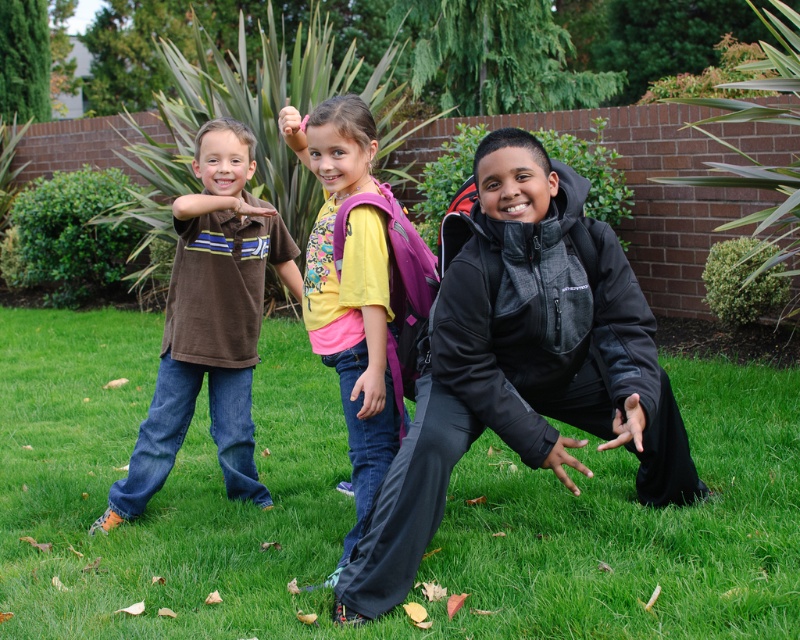
Which is more to the right, black softshell jacket at center or yellow cotton shirt at center?

black softshell jacket at center

What do you see at coordinates (521, 362) in the screenshot? Image resolution: width=800 pixels, height=640 pixels. I see `black softshell jacket at center` at bounding box center [521, 362].

Where is `black softshell jacket at center`? This screenshot has width=800, height=640. black softshell jacket at center is located at coordinates (521, 362).

Is green grass at center smaller than black softshell jacket at center?

Yes, green grass at center is smaller than black softshell jacket at center.

Does green grass at center have a lesser width compared to black softshell jacket at center?

A: Yes, green grass at center is thinner than black softshell jacket at center.

Is point (172, 620) positioned behind point (536, 342)?

Yes, it is behind point (536, 342).

I want to click on green grass at center, so click(354, 508).

Who is lower down, black softshell jacket at center or brown cotton shirt at left?

black softshell jacket at center is lower down.

Which of these two, black softshell jacket at center or brown cotton shirt at left, stands shorter?

Standing shorter between the two is black softshell jacket at center.

Measure the distance between point (670,406) and camera.

They are 3.29 meters apart.

You are a GUI agent. You are given a task and a screenshot of the screen. Output one action in this format:
    pyautogui.click(x=<x>, y=<y>)
    Task: Click on the black softshell jacket at center
    
    Given the screenshot: What is the action you would take?
    pyautogui.click(x=521, y=362)